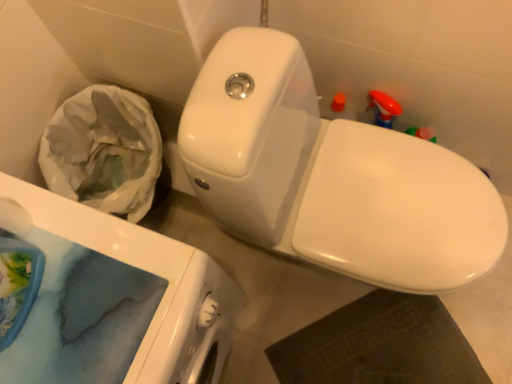
This screenshot has height=384, width=512. I want to click on empty space that is ontop of white glossy porcelain at upper right (from a real-world perspective), so click(86, 294).